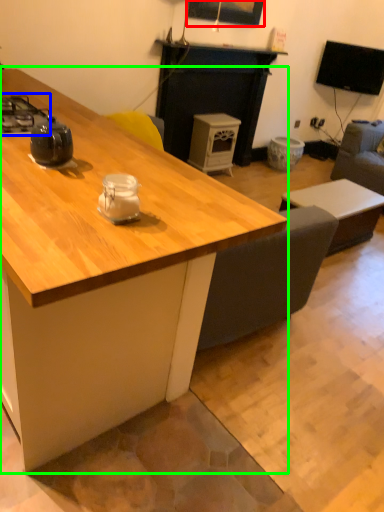
Question: Based on their relative distances, which object is farther from picture frame (highlighted by a red box)? Choose from gas stove (highlighted by a blue box) and desk (highlighted by a green box).

Choices:
 (A) gas stove
 (B) desk

Answer: (B)